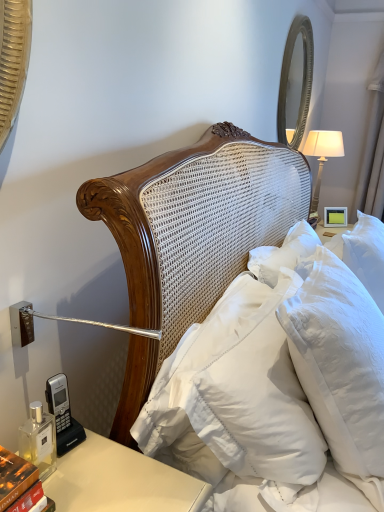
Measure the distance between point (307, 79) and camera.

A distance of 8.62 feet exists between point (307, 79) and camera.

Where is `silver textured mirror at upper right`? The image size is (384, 512). silver textured mirror at upper right is located at coordinates (302, 79).

In order to face white soft pillow at center, the first pillow positioned from the left, should I rotate leftwards or rightwards?

You should rotate right by 12.659 degrees.

The height and width of the screenshot is (512, 384). Describe the element at coordinates (341, 367) in the screenshot. I see `white soft pillow at upper right, the second pillow from the left` at that location.

You are a GUI agent. You are given a task and a screenshot of the screen. Output one action in this format:
    pyautogui.click(x=<x>, y=<y>)
    Task: Click on the silver textured mirror at upper right
    The width and height of the screenshot is (384, 512).
    Given the screenshot: What is the action you would take?
    pyautogui.click(x=302, y=79)

This screenshot has width=384, height=512. I want to click on bedside lamp above the white soft pillow at upper right, the 1th pillow from the right (from a real-world perspective), so click(323, 153).

Is white soft pillow at upper right, the 1th pillow from the right, inside or outside of white fabric lampshade at upper right?

white soft pillow at upper right, the 1th pillow from the right, is spatially situated outside white fabric lampshade at upper right.

Between white soft pillow at upper right, the second pillow from the left, and white fabric lampshade at upper right, which one appears on the left side from the viewer's perspective?

white soft pillow at upper right, the second pillow from the left, is more to the left.

Is the surface of white soft pillow at upper right, the second pillow from the left, in direct contact with white fabric lampshade at upper right?

white soft pillow at upper right, the second pillow from the left, and white fabric lampshade at upper right are not in contact.

In the image, is hardcover book at lower left positioned in front of or behind white soft pillow at center, the 2th pillow positioned from the right?

Clearly, hardcover book at lower left is in front of white soft pillow at center, the 2th pillow positioned from the right.

Considering the relative positions of hardcover book at lower left and white soft pillow at center, the 2th pillow positioned from the right, in the image provided, is hardcover book at lower left to the right of white soft pillow at center, the 2th pillow positioned from the right, from the viewer's perspective?

In fact, hardcover book at lower left is to the left of white soft pillow at center, the 2th pillow positioned from the right.

How far apart are hardcover book at lower left and white soft pillow at center, the first pillow positioned from the left?

hardcover book at lower left is 49.95 centimeters away from white soft pillow at center, the first pillow positioned from the left.

Between hardcover book at lower left and white soft pillow at center, the 2th pillow positioned from the right, which one has less height?

With less height is hardcover book at lower left.

Considering the relative positions of white fabric lampshade at upper right and white soft pillow at upper right, the 1th pillow from the right, in the image provided, is white fabric lampshade at upper right in front of white soft pillow at upper right, the 1th pillow from the right,?

No, it is behind white soft pillow at upper right, the 1th pillow from the right.

Is white fabric lampshade at upper right not near white soft pillow at upper right, the second pillow from the left?

Yes.

Looking at this image, considering the sizes of objects white fabric lampshade at upper right and white soft pillow at upper right, the 1th pillow from the right, in the image provided, who is smaller, white fabric lampshade at upper right or white soft pillow at upper right, the 1th pillow from the right,?

With smaller size is white fabric lampshade at upper right.

Is point (313, 151) positioned before point (342, 375)?

No, it is not.

Does matte yellow picture frame at upper right lie behind white fabric lampshade at upper right?

Yes, matte yellow picture frame at upper right is further from the viewer.

Considering the sizes of matte yellow picture frame at upper right and white fabric lampshade at upper right in the image, is matte yellow picture frame at upper right wider or thinner than white fabric lampshade at upper right?

Clearly, matte yellow picture frame at upper right has less width compared to white fabric lampshade at upper right.

Is matte yellow picture frame at upper right with white fabric lampshade at upper right?

No, matte yellow picture frame at upper right is not making contact with white fabric lampshade at upper right.

In order to click on picture frame that is below the white fabric lampshade at upper right (from the image's perspective) in this screenshot , I will do `click(335, 216)`.

Would you say white soft pillow at upper right, the 1th pillow from the right, is inside or outside matte yellow picture frame at upper right?

white soft pillow at upper right, the 1th pillow from the right, is spatially situated outside matte yellow picture frame at upper right.

Which is more to the left, white soft pillow at upper right, the 1th pillow from the right, or matte yellow picture frame at upper right?

Positioned to the left is white soft pillow at upper right, the 1th pillow from the right.

Identify the location of the 2nd pillow in front of the matte yellow picture frame at upper right. Image resolution: width=384 pixels, height=512 pixels. (341, 367).

Looking at the image, does white fabric lampshade at upper right seem bigger or smaller compared to white soft pillow at center, the 2th pillow positioned from the right?

In the image, white fabric lampshade at upper right appears to be smaller than white soft pillow at center, the 2th pillow positioned from the right.

Does point (343, 145) lie in front of point (301, 476)?

No, (343, 145) is behind (301, 476).

You are a GUI agent. You are given a task and a screenshot of the screen. Output one action in this format:
    pyautogui.click(x=<x>, y=<y>)
    Task: Click on the bedside lamp on the right of white soft pillow at center, the 2th pillow positioned from the right
    
    Given the screenshot: What is the action you would take?
    pyautogui.click(x=323, y=153)

What are the coordinates of `the 2nd pillow to the right of the hardcover book at lower left, starting your count from the anchor` in the screenshot? It's located at (341, 367).

From the picture: Is white soft pillow at upper right, the 1th pillow from the right, with hardcover book at lower left?

There is a gap between white soft pillow at upper right, the 1th pillow from the right, and hardcover book at lower left.

Does white soft pillow at upper right, the second pillow from the left, contain hardcover book at lower left?

Actually, hardcover book at lower left is outside white soft pillow at upper right, the second pillow from the left.

Is point (379, 488) more distant than point (17, 499)?

That is True.

At what (x,y) coordinates should I click in order to perform the action: click on pillow that is the 1st one when counting leftward from the white fabric lampshade at upper right. Please return your answer as a coordinate pair (x, y). This screenshot has height=512, width=384. Looking at the image, I should click on (341, 367).

Which pillow is the 1st one when counting from the right side of the hardcover book at lower left? Please provide its 2D coordinates.

[(236, 393)]

Estimate the real-world distances between objects in this image. Which object is closer to white soft pillow at center, the first pillow positioned from the left, white fabric lampshade at upper right or silver textured mirror at upper right?

The object closer to white soft pillow at center, the first pillow positioned from the left, is silver textured mirror at upper right.

From the image, which object appears to be nearer to silver textured mirror at upper right, white soft pillow at center, the first pillow positioned from the left, or white fabric lampshade at upper right?

Based on the image, white fabric lampshade at upper right appears to be nearer to silver textured mirror at upper right.

Considering their positions, is white soft pillow at center, the 2th pillow positioned from the right, positioned further to white fabric lampshade at upper right than silver textured mirror at upper right?

Among the two, white soft pillow at center, the 2th pillow positioned from the right, is located further to white fabric lampshade at upper right.

When comparing their distances from white soft pillow at center, the 2th pillow positioned from the right, does silver textured mirror at upper right or white fabric lampshade at upper right seem closer?

The object closer to white soft pillow at center, the 2th pillow positioned from the right, is silver textured mirror at upper right.

From the image, which object appears to be farther from silver textured mirror at upper right, white soft pillow at upper right, the 1th pillow from the right, or white fabric lampshade at upper right?

Among the two, white soft pillow at upper right, the 1th pillow from the right, is located further to silver textured mirror at upper right.

From the image, which object appears to be nearer to white fabric lampshade at upper right, hardcover book at lower left or matte yellow picture frame at upper right?

Based on the image, matte yellow picture frame at upper right appears to be nearer to white fabric lampshade at upper right.

Which object lies further to the anchor point matte yellow picture frame at upper right, silver textured mirror at upper right or white fabric lampshade at upper right?

The object further to matte yellow picture frame at upper right is silver textured mirror at upper right.

Based on their spatial positions, is white soft pillow at upper right, the 1th pillow from the right, or matte yellow picture frame at upper right closer to white soft pillow at center, the 2th pillow positioned from the right?

Among the two, white soft pillow at upper right, the 1th pillow from the right, is located nearer to white soft pillow at center, the 2th pillow positioned from the right.

At what (x,y) coordinates should I click in order to perform the action: click on mirror between white soft pillow at upper right, the second pillow from the left, and matte yellow picture frame at upper right in the front-back direction. Please return your answer as a coordinate pair (x, y). This screenshot has width=384, height=512. Looking at the image, I should click on (302, 79).

Locate an element on the screen. The image size is (384, 512). mirror located between hardcover book at lower left and matte yellow picture frame at upper right in the depth direction is located at coordinates (302, 79).

This screenshot has height=512, width=384. I want to click on pillow between white soft pillow at upper right, the second pillow from the left, and silver textured mirror at upper right from front to back, so click(236, 393).

Where is `pillow positioned between white soft pillow at upper right, the second pillow from the left, and matte yellow picture frame at upper right from near to far`? pillow positioned between white soft pillow at upper right, the second pillow from the left, and matte yellow picture frame at upper right from near to far is located at coordinates (236, 393).